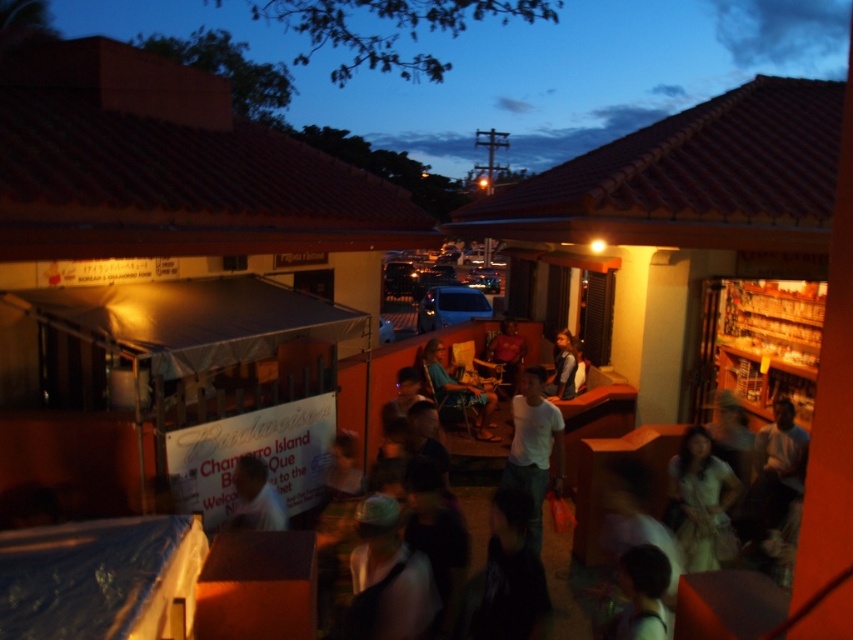
Can you confirm if white fabric dress at lower right is taller than blue fabric chair at center?

In fact, white fabric dress at lower right may be shorter than blue fabric chair at center.

Does white fabric dress at lower right have a greater width compared to blue fabric chair at center?

In fact, white fabric dress at lower right might be narrower than blue fabric chair at center.

I want to click on white fabric dress at lower right, so click(701, 500).

Can you confirm if matte white signboard at center is positioned to the left of blue fabric chair at center?

Yes, matte white signboard at center is to the left of blue fabric chair at center.

Consider the image. Who is higher up, matte white signboard at center or blue fabric chair at center?

blue fabric chair at center

Where is `matte white signboard at center`? matte white signboard at center is located at coordinates (256, 497).

Identify the location of matte white signboard at center. The image size is (853, 640). (256, 497).

Locate an element on the screen. white fabric dress at lower right is located at coordinates (701, 500).

Does white fabric dress at lower right have a greater width compared to matte white signboard at center?

Yes, white fabric dress at lower right is wider than matte white signboard at center.

The image size is (853, 640). In order to click on white fabric dress at lower right in this screenshot , I will do `click(701, 500)`.